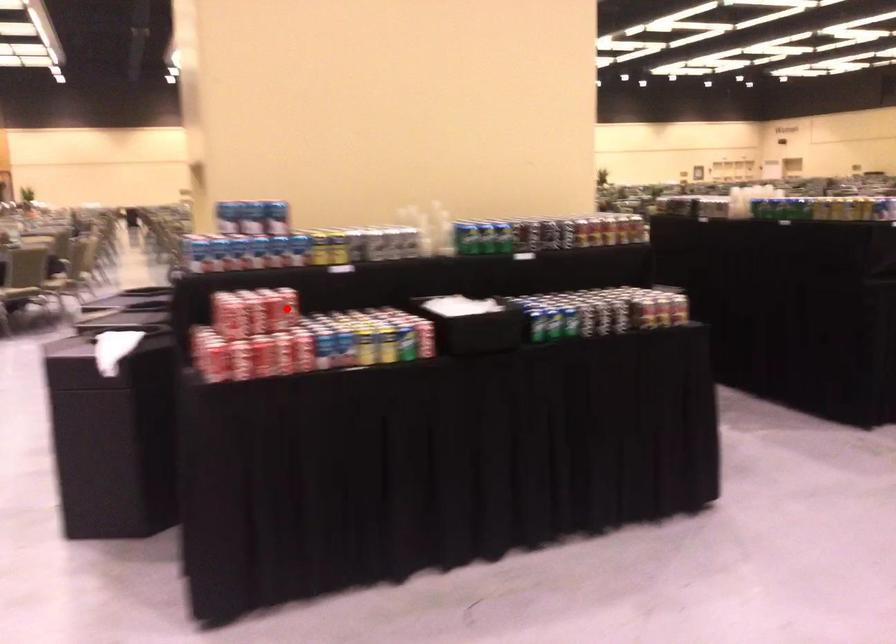
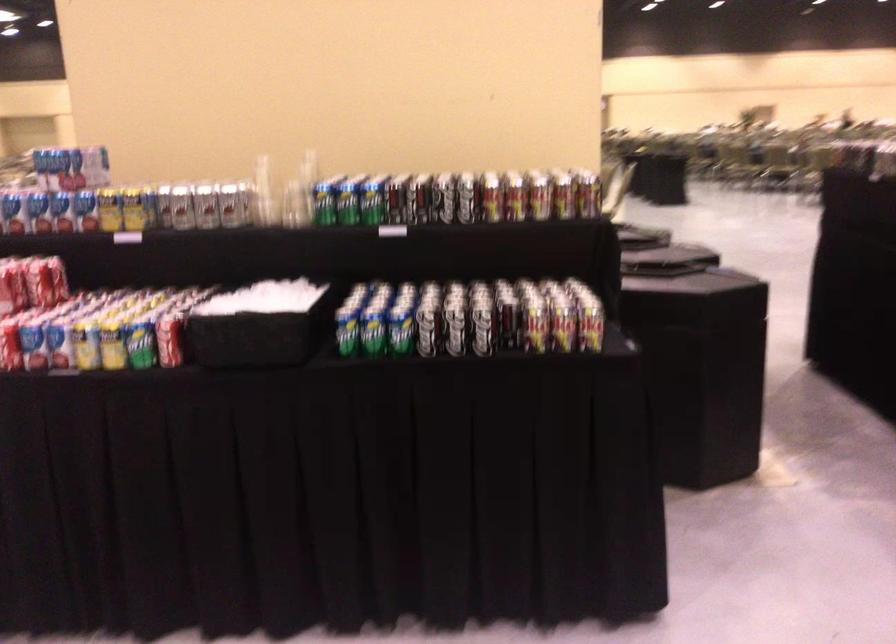
Question: I am providing you with two images of the same scene from different viewpoints. In image1, a red point is highlighted. Considering the same 3D point in image2, which of the following is correct?

Choices:
 (A) It is closer
 (B) It is farther

Answer: (A)